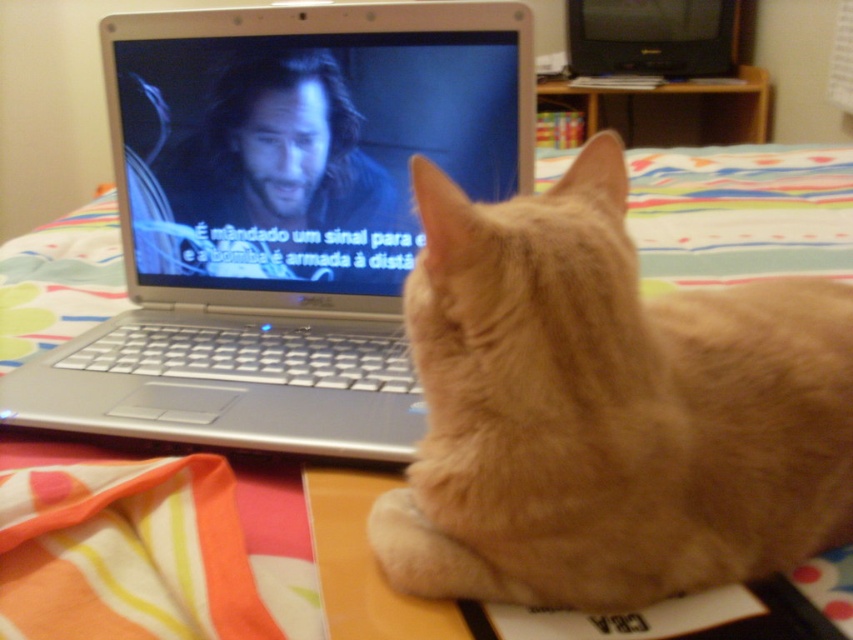
You are a delivery robot navigating through a room. You need to move from point A to point B. Point A is at coordinate point(683, 20) and point B is at coordinate point(770, 380). According to the scene, which point is closer to the bed?

Point(770, 380) is closer to the bed because it is in front of point(683, 20), which means it is nearer to the bed.

You are an interior designer assessing the living room layout. The orange fur cat at center and the black plastic television at upper right are both in the room. Based on their sizes, which object would you recommend placing on a smaller shelf to save space?

The orange fur cat at center has a smaller size compared to the black plastic television at upper right, so it would be more suitable to place the orange fur cat at center on a smaller shelf to save space.

You are a photographer trying to capture a clear photo of the silver metallic laptop at center without the orange fur cat at center blocking it. What should you do?

The orange fur cat at center is positioned under the silver metallic laptop at center, so you can move the orange fur cat at center to the side or adjust the angle of the laptop to ensure it is visible in the photo.